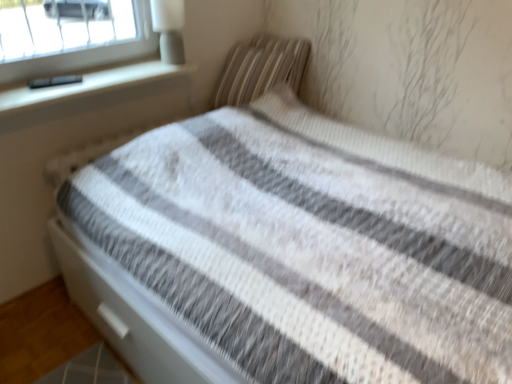
Question: Is white matte lamp at upper left spatially inside striped fabric pillow at upper right, or outside of it?

Choices:
 (A) inside
 (B) outside

Answer: (B)

Question: Is white matte lamp at upper left wider or thinner than striped fabric pillow at upper right?

Choices:
 (A) wide
 (B) thin

Answer: (B)

Question: In terms of height, does white matte lamp at upper left look taller or shorter compared to striped fabric pillow at upper right?

Choices:
 (A) tall
 (B) short

Answer: (B)

Question: In terms of width, does striped fabric pillow at upper right look wider or thinner when compared to white matte lamp at upper left?

Choices:
 (A) thin
 (B) wide

Answer: (B)

Question: In the image, is striped fabric pillow at upper right on the left side or the right side of white matte lamp at upper left?

Choices:
 (A) right
 (B) left

Answer: (A)

Question: Choose the correct answer: Is striped fabric pillow at upper right inside white matte lamp at upper left or outside it?

Choices:
 (A) inside
 (B) outside

Answer: (B)

Question: From the image's perspective, is striped fabric pillow at upper right above or below white matte lamp at upper left?

Choices:
 (A) below
 (B) above

Answer: (A)